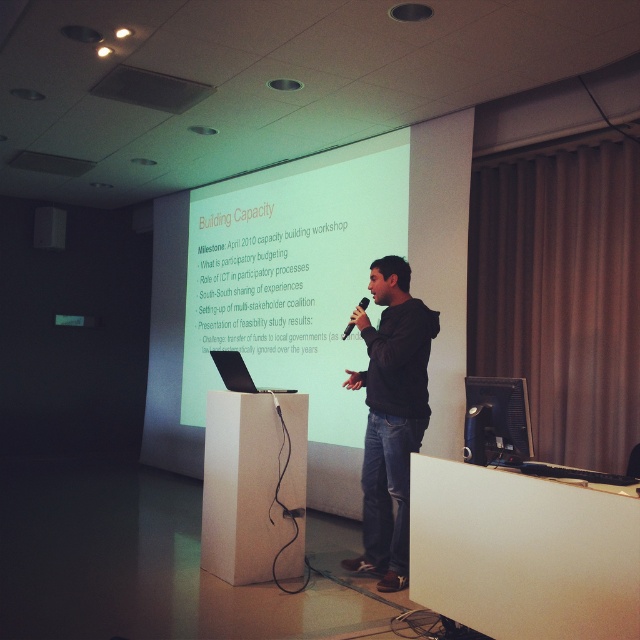
You are an attendee at the presentation. You want to take a photo of the slide on the white matte projection screen at center without blocking the presenter. Since the black hoodie at center is in the way, can you move to your right to get a clear shot?

The white matte projection screen at center is to the left of the black hoodie at center, so if you move to your right, you would be moving away from the screen. To avoid blocking the presenter and get a clear shot, you should move to your left instead.

You are standing in the room and want to adjust the position of the white matte projection screen at center. What are the coordinates where you should place it?

The white matte projection screen at center should be placed at coordinates (x=292, y=275).